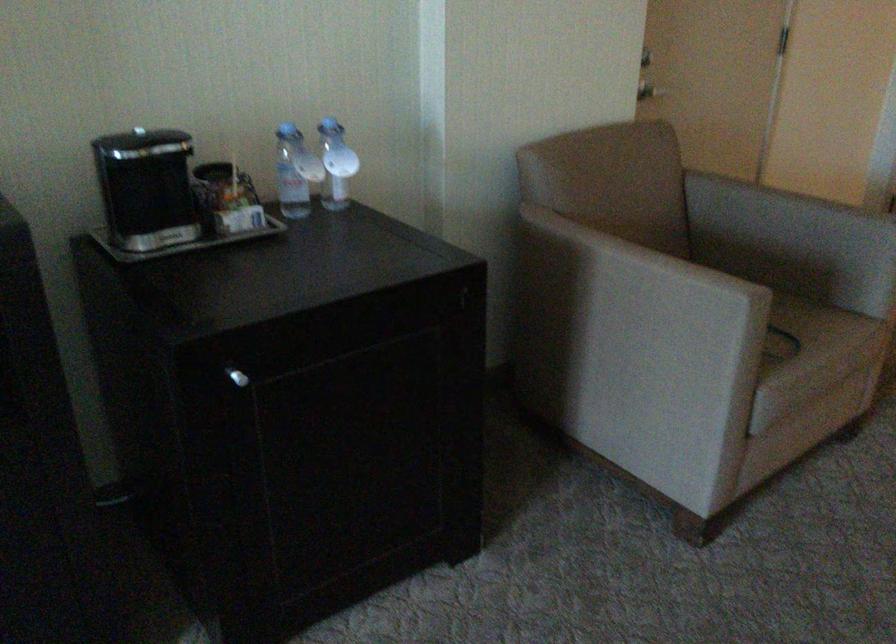
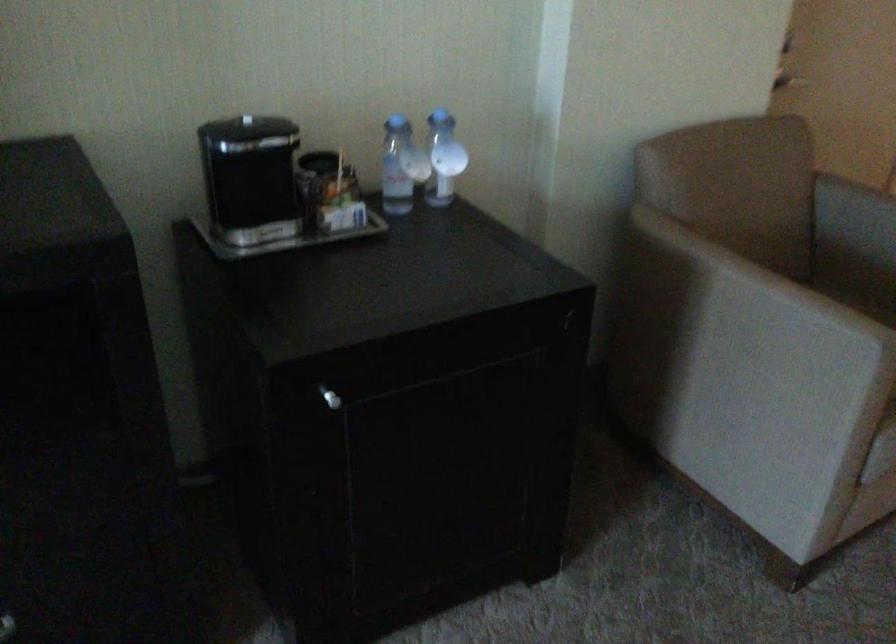
Which direction would the cameraman need to move to produce the second image?

The movement direction of the cameraman is left, forward.